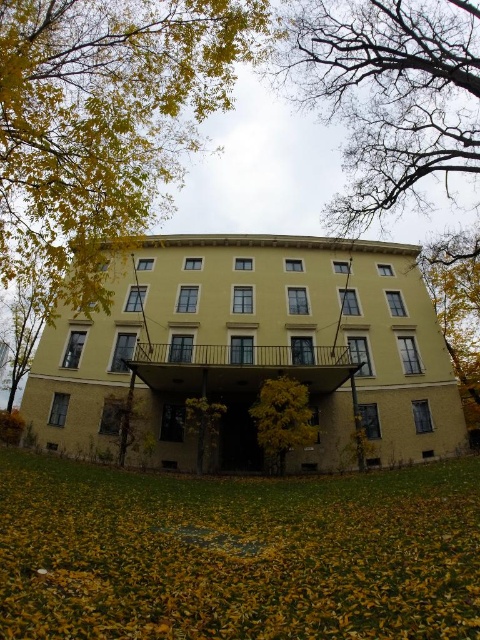
Question: Can you confirm if yellow-green foliage at center is bigger than green leafy tree at center?

Choices:
 (A) no
 (B) yes

Answer: (B)

Question: Does yellow leaf litter at lower center lie in front of bare branches at upper center?

Choices:
 (A) no
 (B) yes

Answer: (B)

Question: Among these points, which one is nearest to the camera?

Choices:
 (A) (134, 589)
 (B) (205, 422)
 (C) (456, 257)

Answer: (A)

Question: Based on their relative distances, which object is farther from the bare branches at upper center?

Choices:
 (A) yellow leafy tree at upper left
 (B) yellow-green foliage at center
 (C) yellow leaf litter at lower center
 (D) green leafy tree at center

Answer: (D)

Question: Estimate the real-world distances between objects in this image. Which object is farther from the bare branches at upper center?

Choices:
 (A) yellow leaf litter at lower center
 (B) green leafy tree at center

Answer: (B)

Question: Is yellow leafy tree at upper left positioned at the back of bare branches at upper center?

Choices:
 (A) no
 (B) yes

Answer: (A)